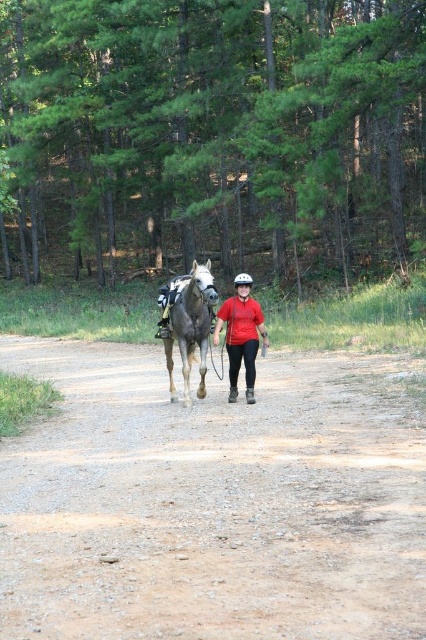
You are a hiker following the brown gravel dirt track at center and the brown textured horse at center is also on the path. Which object is closer to you as you walk along the track?

The brown gravel dirt track at center is in front of the brown textured horse at center, so the dirt track is closer to you as you walk along it.

You are a hiker who wants to follow the path. You see the brown gravel dirt track at center and the matte red shirt at center. Which direction should you walk to stay on the path?

The brown gravel dirt track at center is to the left of the matte red shirt at center, so you should walk to the left of the matte red shirt at center to stay on the path.